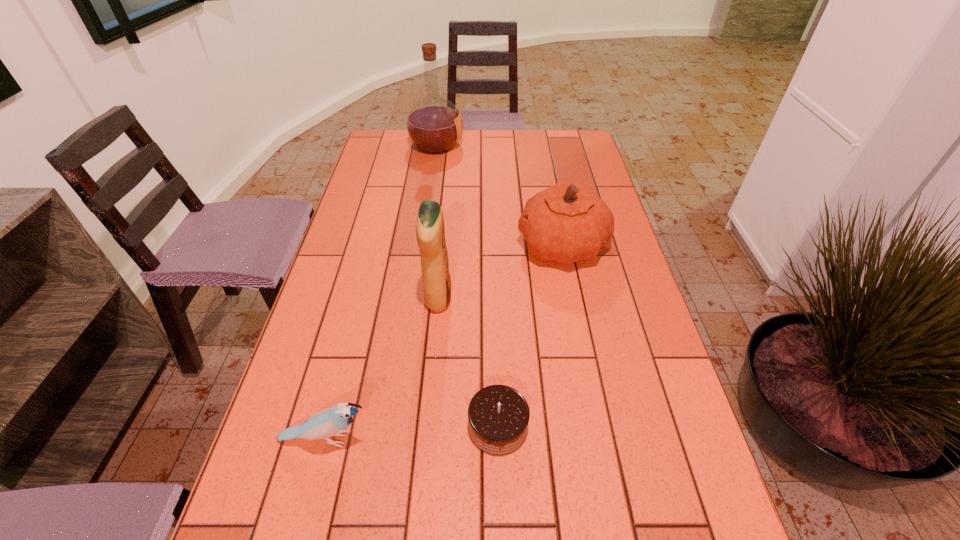
In order to click on object situated at the far left corner in this screenshot , I will do `click(434, 124)`.

Identify the location of free space at the far edge of the desktop. (535, 140).

Where is `free spot at the right edge of the desktop`? free spot at the right edge of the desktop is located at coordinates (651, 372).

The image size is (960, 540). Identify the location of free space at the far left corner of the desktop. point(404,160).

Where is `vacant area at the far right corner`? vacant area at the far right corner is located at coordinates (554, 145).

The image size is (960, 540). Identify the location of free spot between the second farthest object and the second tallest object. (500, 272).

At what (x,y) coordinates should I click in order to perform the action: click on unoccupied area between the bird and the liquor. Please return your answer as a coordinate pair (x, y). Image resolution: width=960 pixels, height=540 pixels. Looking at the image, I should click on (381, 292).

Locate an element on the screen. The width and height of the screenshot is (960, 540). free space that is in between the chocolate cake and the fourth tallest object is located at coordinates [412, 433].

What are the coordinates of `vacant space in between the fourth shortest object and the fourth tallest object` in the screenshot? It's located at (382, 369).

Locate an element on the screen. This screenshot has width=960, height=540. free space between the second object from right to left and the tallest object is located at coordinates (468, 286).